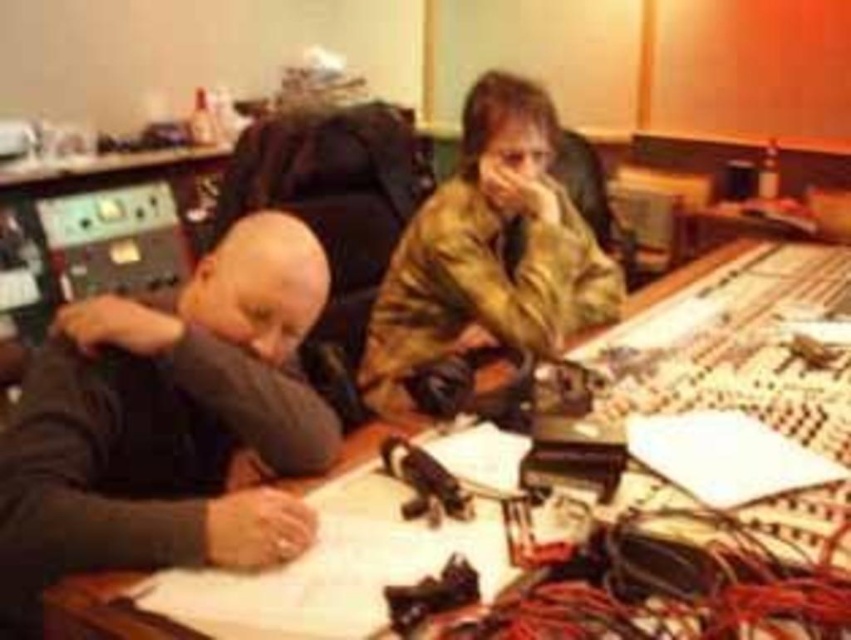
Is white paper at center bigger than dark gray sweater at left?

Indeed, white paper at center has a larger size compared to dark gray sweater at left.

Is white paper at center wider than dark gray sweater at left?

Yes.

Between point (555, 429) and point (250, 566), which one is positioned behind?

Point (555, 429)

I want to click on white paper at center, so click(x=293, y=573).

Does white paper at center appear on the right side of camouflage jacket at center?

Indeed, white paper at center is positioned on the right side of camouflage jacket at center.

This screenshot has width=851, height=640. What are the coordinates of `white paper at center` in the screenshot? It's located at (293, 573).

I want to click on white paper at center, so click(293, 573).

Between point (84, 340) and point (506, 180), which one is positioned in front?

Point (84, 340)

Can you confirm if dark gray sweater at left is positioned to the left of camouflage jacket at center?

Yes, dark gray sweater at left is to the left of camouflage jacket at center.

Does point (272, 230) lie in front of point (473, 284)?

Yes, point (272, 230) is in front of point (473, 284).

In order to click on dark gray sweater at left in this screenshot , I will do `click(168, 422)`.